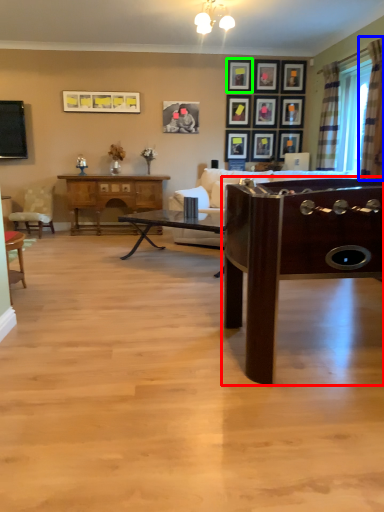
Question: Based on their relative distances, which object is nearer to table (highlighted by a red box)? Choose from curtain (highlighted by a blue box) and picture frame (highlighted by a green box).

Choices:
 (A) curtain
 (B) picture frame

Answer: (A)